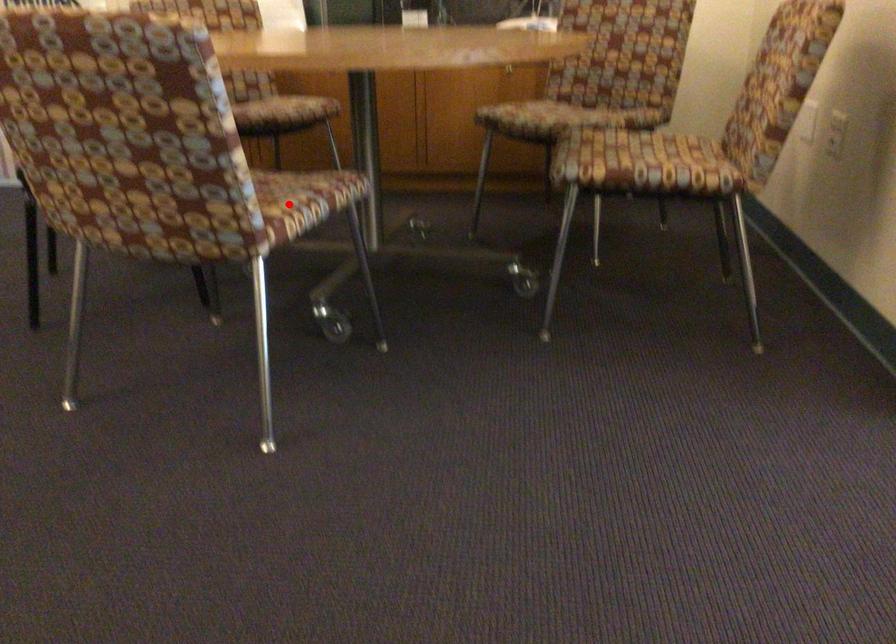
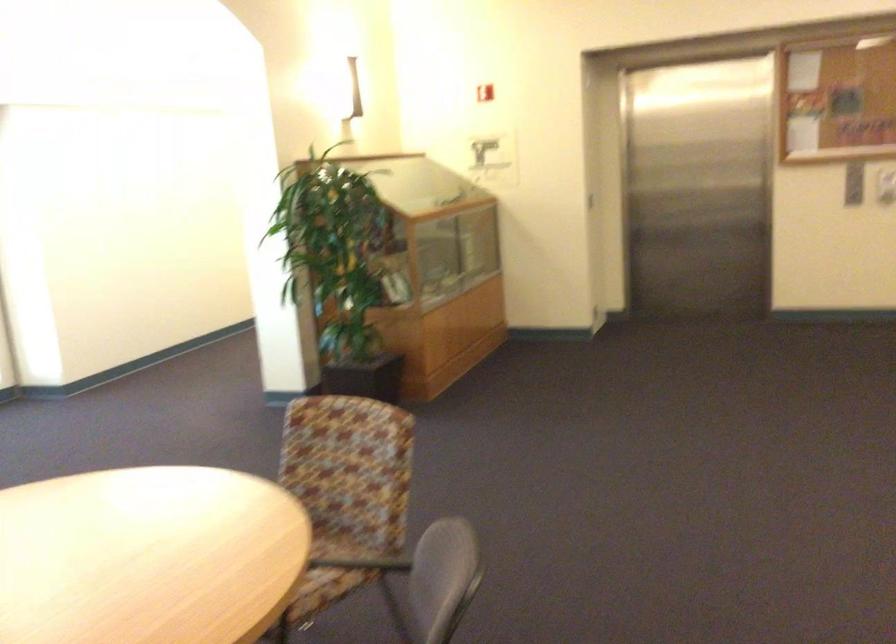
Question: I am providing you with two images of the same scene from different viewpoints. A red point is marked on the first image. Is the red point's position out of view in image 2?

Choices:
 (A) Yes
 (B) No

Answer: (A)